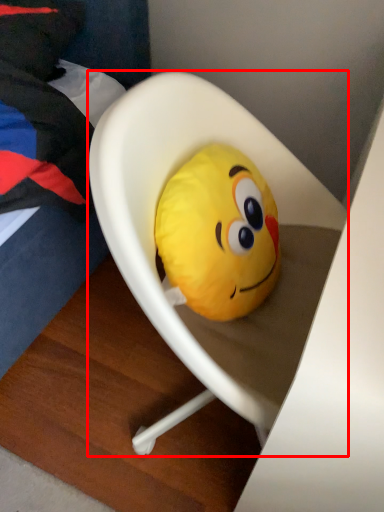
Question: From the image's perspective, where is furniture (annotated by the red box) located relative to toy?

Choices:
 (A) above
 (B) below

Answer: (B)